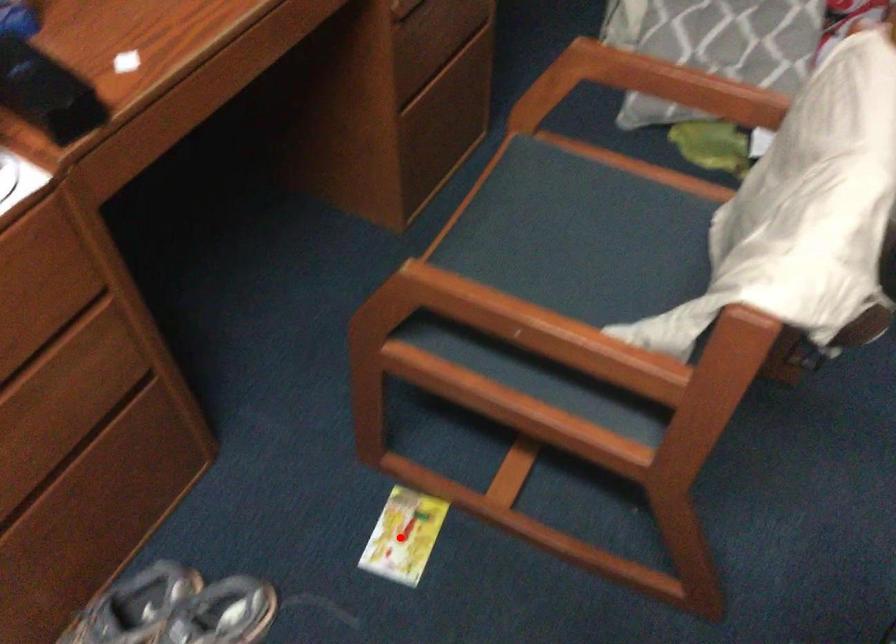
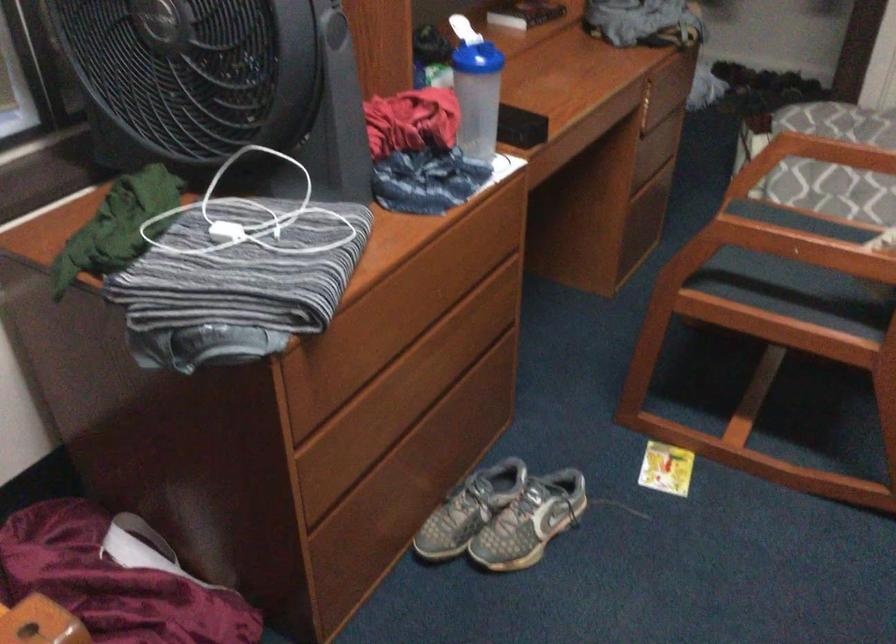
Question: A red point is marked in image1. In image2, is the corresponding 3D point closer to the camera or farther? Reply with the corresponding letter.

Choices:
 (A) The corresponding 3D point is closer.
 (B) The corresponding 3D point is farther.

Answer: (B)